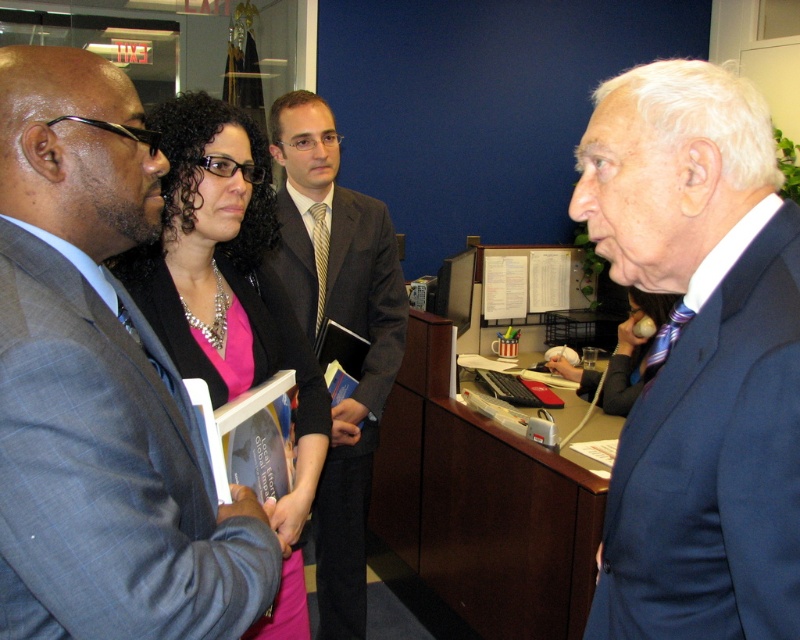
Question: Considering the real-world distances, which object is closest to the pink satin blouse at center?

Choices:
 (A) blue suit at right
 (B) matte gray suit at center
 (C) dark gray suit at center

Answer: (B)

Question: Is matte gray suit at center closer to camera compared to blue suit at right?

Choices:
 (A) yes
 (B) no

Answer: (A)

Question: Which point appears closest to the camera in this image?

Choices:
 (A) (350, 252)
 (B) (768, 289)
 (C) (258, 320)
 (D) (81, 81)

Answer: (B)

Question: Is pink satin blouse at center below dark gray suit at center?

Choices:
 (A) no
 (B) yes

Answer: (A)

Question: Does matte gray suit at center come behind blue suit at right?

Choices:
 (A) yes
 (B) no

Answer: (B)

Question: Which is farther from the pink satin blouse at center?

Choices:
 (A) matte gray suit at center
 (B) dark gray suit at center

Answer: (B)